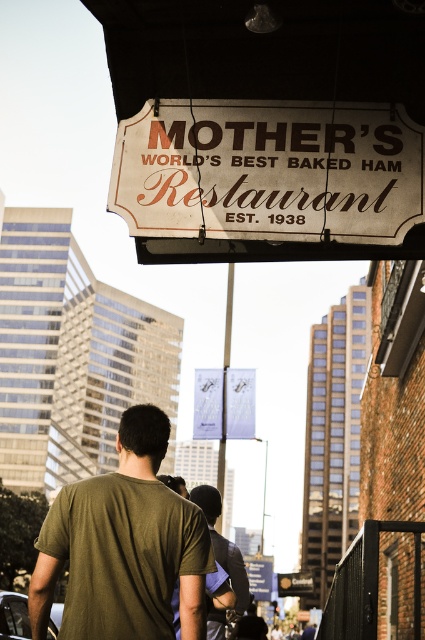
You are a tourist standing in front of the restaurant and want to read both the white painted wood sign at upper center and the white paper sign at center. Which sign should you look to your left to see?

The white painted wood sign at upper center is to the right of the white paper sign at center. Therefore, to see the white paper sign at center, you should look to your left since it is positioned to the left of the white painted wood sign at upper center.